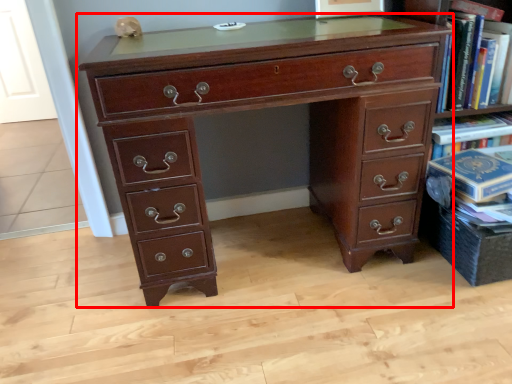
Question: In this image, where is chest of drawers (annotated by the red box) located relative to book?

Choices:
 (A) left
 (B) right

Answer: (A)